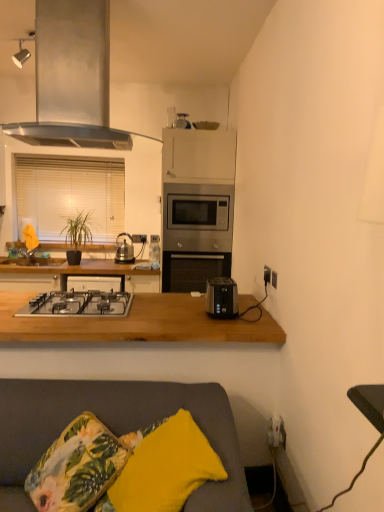
This screenshot has height=512, width=384. I want to click on vacant space situated above white blinds at left (from a real-world perspective), so click(87, 154).